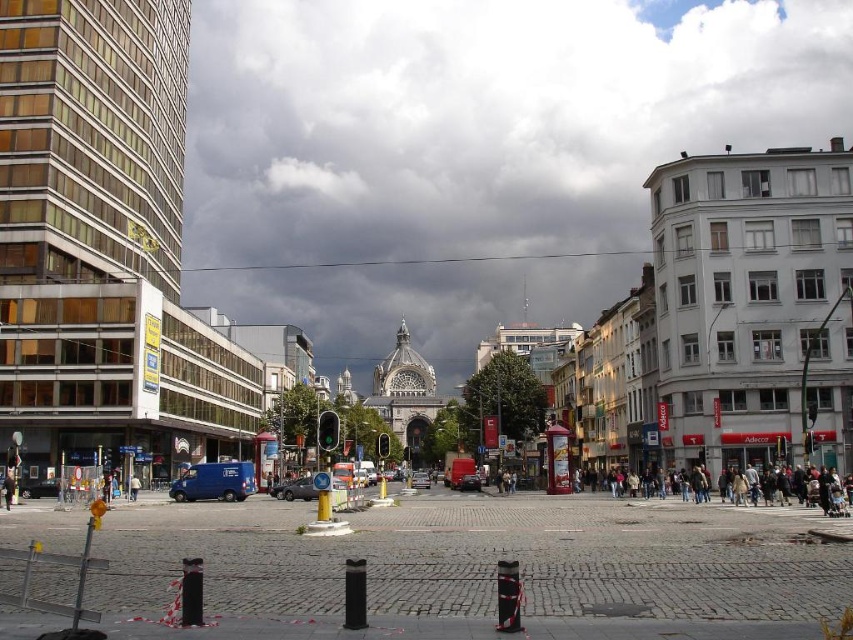
You are a delivery driver who needs to park your shiny silver car at center in a parking lot that requires a minimum clearance of 1000 feet from the cloudy sky at center. Can your car park there?

The cloudy sky at center is 1136.83 feet from shiny silver car at center. Since the parking lot requires a minimum clearance of 1000 feet, the car can park there as the distance meets the requirement.

You are a pedestrian standing at the edge of the cobblestone plaza. You see a shiny silver car at center and a metallic silver car at center. Which car is closer to you?

The shiny silver car at center is closer to you because it is in front of the metallic silver car at center.

You are standing in the plaza and see the cloudy sky at center and the shiny silver car at center. Which object is positioned to the right of the other?

The cloudy sky at center is to the right of the shiny silver car at center.